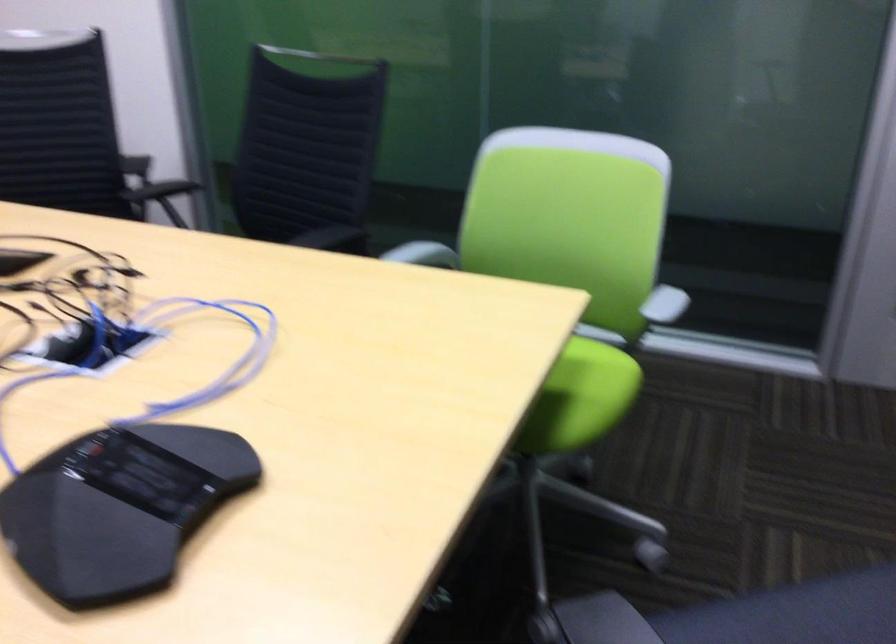
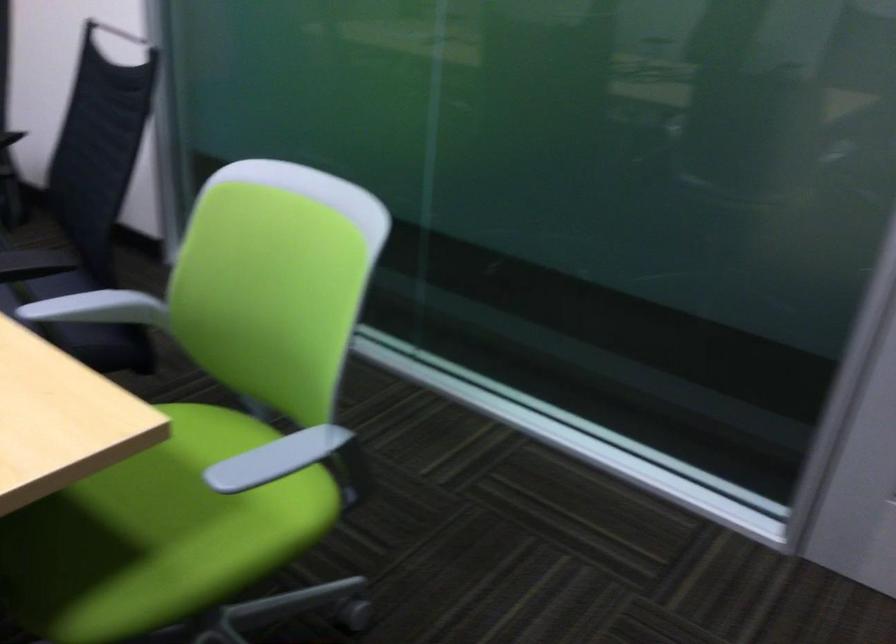
Question: Based on the continuous images, in which direction is the camera rotating? Reply with the corresponding letter.

Choices:
 (A) Left
 (B) Right
 (C) Up
 (D) Down

Answer: (A)